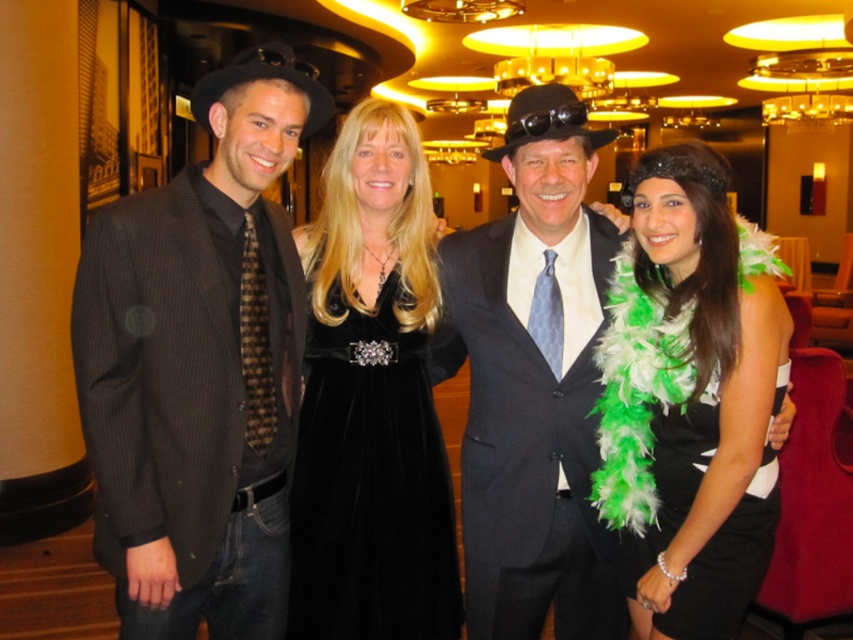
Is white feather boa at center positioned in front of dark gray wool suit at center?

That is True.

Between white feather boa at center and dark gray wool suit at center, which one is positioned lower?

dark gray wool suit at center is below.

What do you see at coordinates (689, 397) in the screenshot? I see `white feather boa at center` at bounding box center [689, 397].

Identify the location of white feather boa at center. The image size is (853, 640). (689, 397).

What do you see at coordinates (199, 365) in the screenshot? I see `matte black suit at left` at bounding box center [199, 365].

Find the location of a particular element. Image resolution: width=853 pixels, height=640 pixels. matte black suit at left is located at coordinates (199, 365).

Can you confirm if matte black suit at left is shorter than matte black suit at center?

Incorrect, matte black suit at left's height does not fall short of matte black suit at center's.

This screenshot has width=853, height=640. Describe the element at coordinates (199, 365) in the screenshot. I see `matte black suit at left` at that location.

Image resolution: width=853 pixels, height=640 pixels. Find the location of `matte black suit at left`. matte black suit at left is located at coordinates (199, 365).